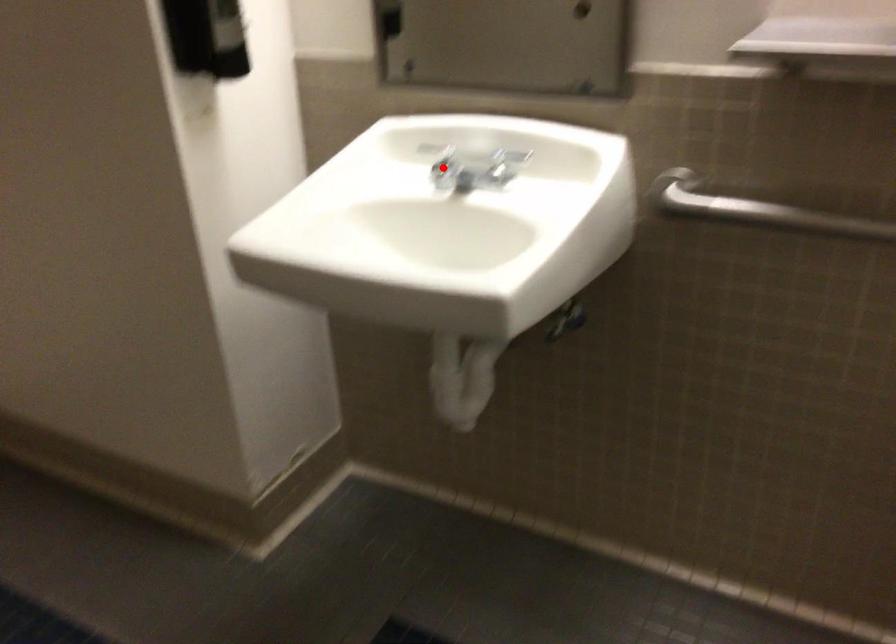
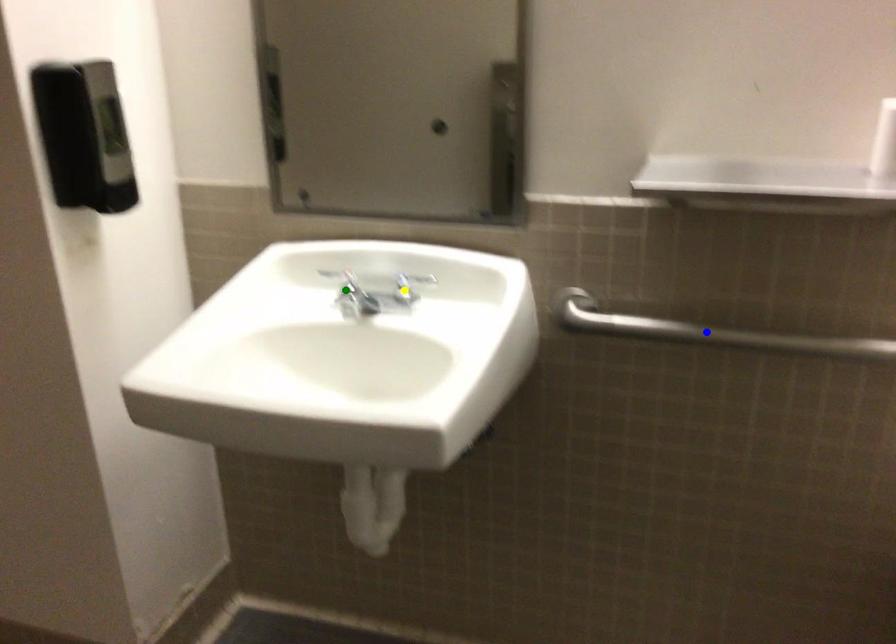
Question: I am providing you with two images of the same scene from different viewpoints. A red point is marked on the first image. You are given multiple points on the second image. Which spot in image 2 lines up with the point in image 1?

Choices:
 (A) yellow point
 (B) blue point
 (C) green point

Answer: (C)